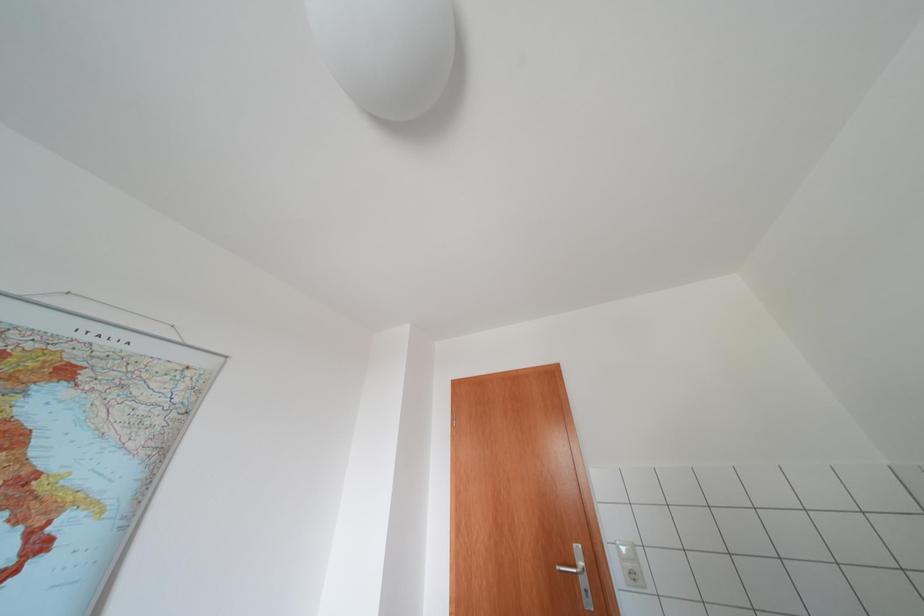
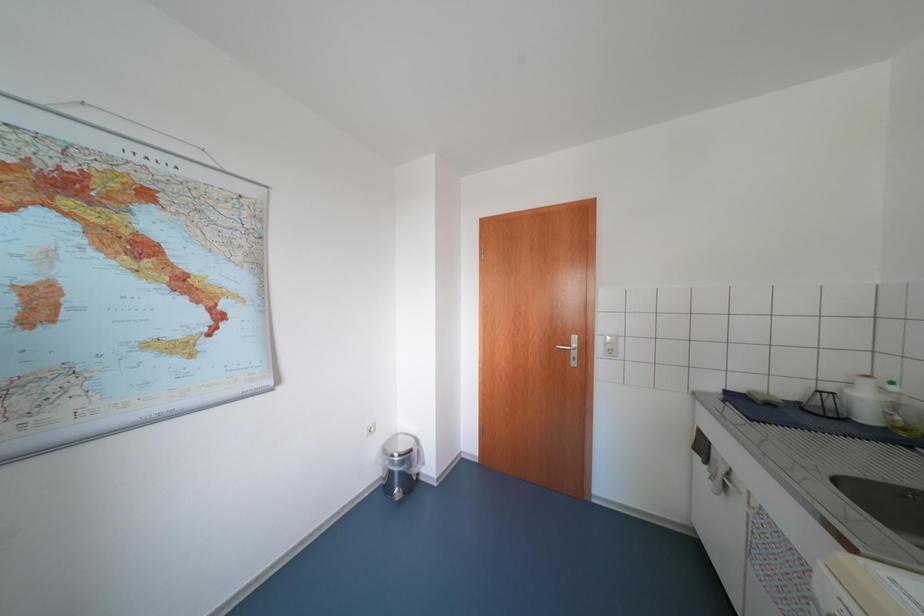
Question: The first image is from the beginning of the video and the second image is from the end. How did the camera likely rotate when shooting the video?

Choices:
 (A) Left
 (B) Right
 (C) Up
 (D) Down

Answer: (D)